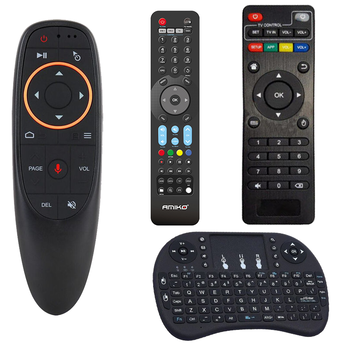
This screenshot has width=350, height=350. In order to click on remote controls in this screenshot , I will do `click(88, 177)`, `click(166, 161)`, `click(261, 159)`, `click(223, 289)`.